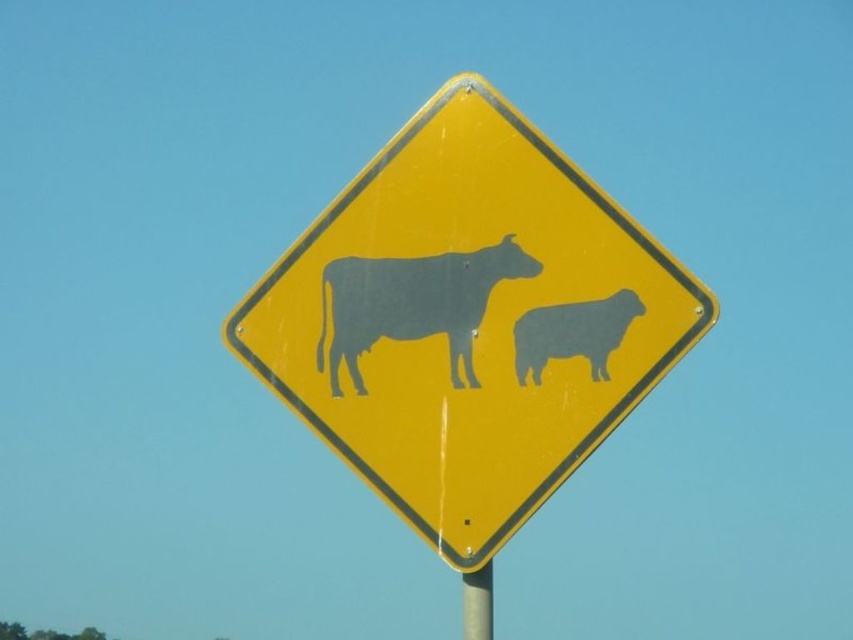
You are a driver approaching an intersection and see the yellow plastic sign at center and the matte gray bull at center. Which object is located higher in the image?

The matte gray bull at center is higher in the image than the yellow plastic sign at center.

You are driving and see a yellow plastic sign at center and a matte gray bull at center. Which object is positioned to the right side?

The yellow plastic sign at center is to the right of the matte gray bull at center.